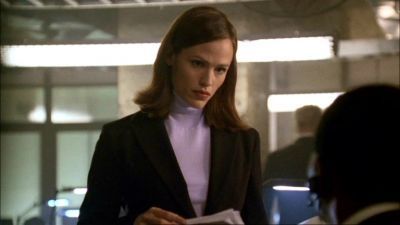
The width and height of the screenshot is (400, 225). In order to click on wall in this screenshot , I will do `click(135, 80)`.